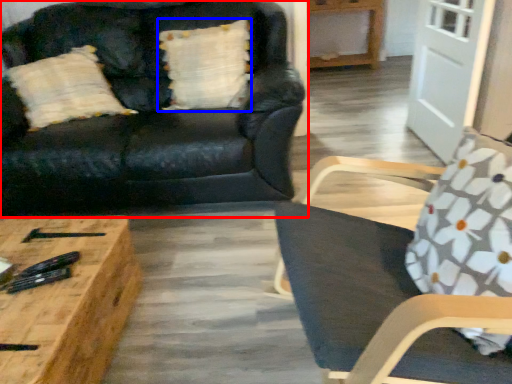
Question: Which point is closer to the camera, studio couch (highlighted by a red box) or pillow (highlighted by a blue box)?

Choices:
 (A) studio couch
 (B) pillow

Answer: (A)